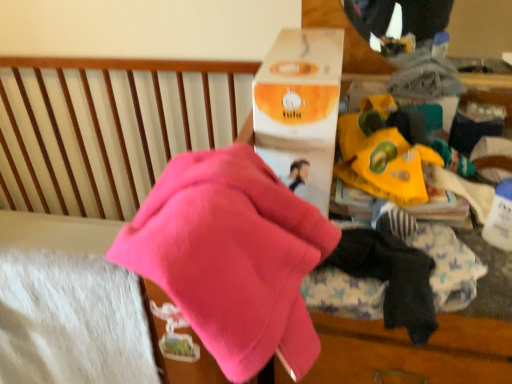
Question: From a real-world perspective, relative to orange matte cardboard box at upper center, is pink fleece at center vertically above or below?

Choices:
 (A) below
 (B) above

Answer: (A)

Question: In the image, is pink fleece at center positioned in front of or behind orange matte cardboard box at upper center?

Choices:
 (A) behind
 (B) front

Answer: (B)

Question: Based on their relative distances, which object is farther from the yellow paper bag at center?

Choices:
 (A) orange matte cardboard box at upper center
 (B) pink fleece at center
 (C) dark blue cotton socks at lower right

Answer: (B)

Question: Based on their relative distances, which object is farther from the pink fleece at center?

Choices:
 (A) yellow paper bag at center
 (B) orange matte cardboard box at upper center
 (C) dark blue cotton socks at lower right

Answer: (A)